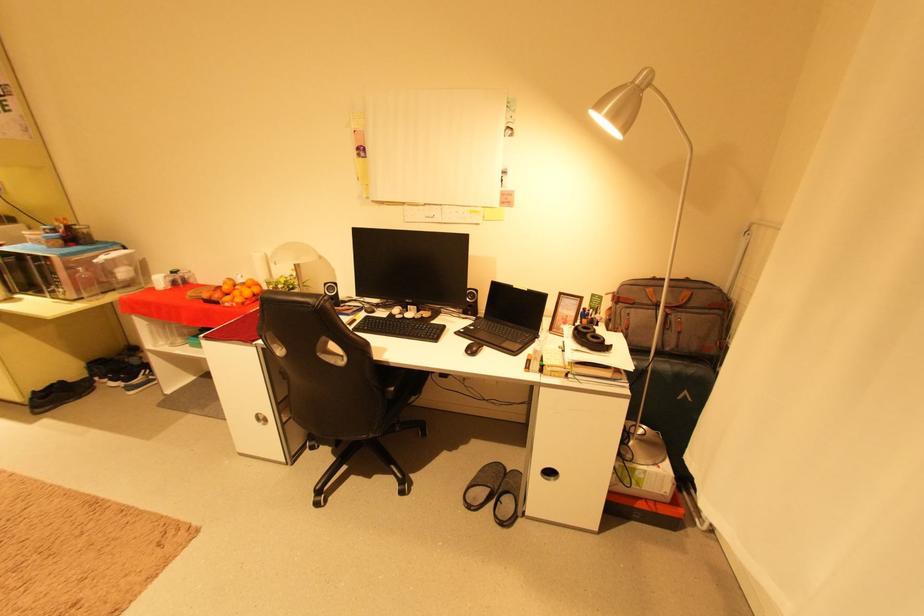
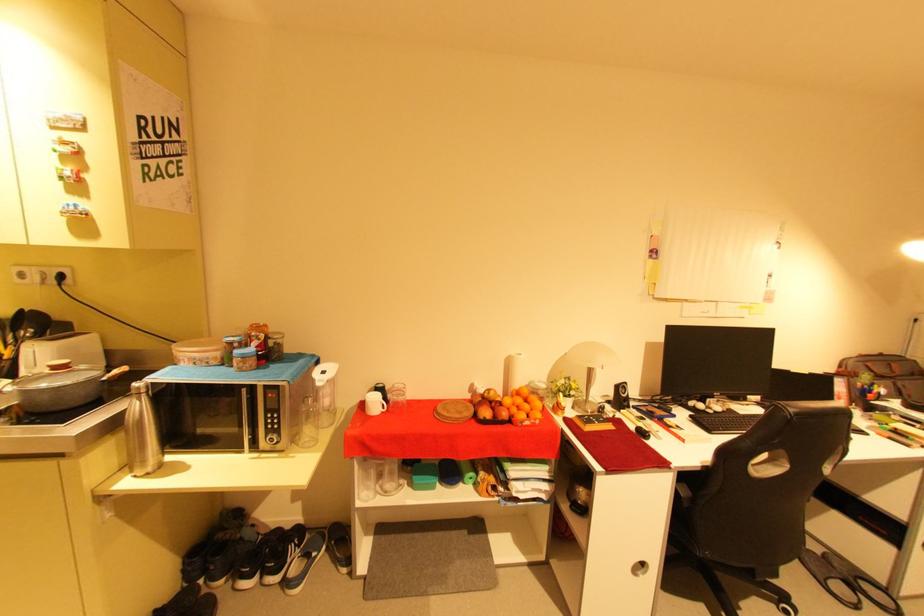
The point at (665,278) is marked in the first image. Where is the corresponding point in the second image?

(871, 354)